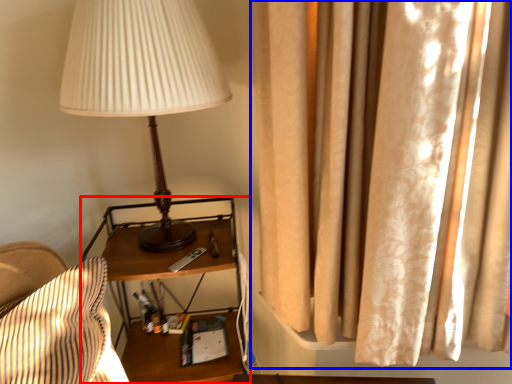
Question: Which of the following is the closest to the observer, nightstand (highlighted by a red box) or curtain (highlighted by a blue box)?

Choices:
 (A) nightstand
 (B) curtain

Answer: (B)